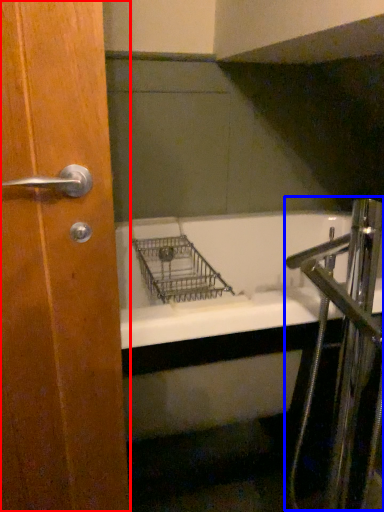
Question: Which object appears farthest to the camera in this image, door (highlighted by a red box) or faucet (highlighted by a blue box)?

Choices:
 (A) door
 (B) faucet

Answer: (B)